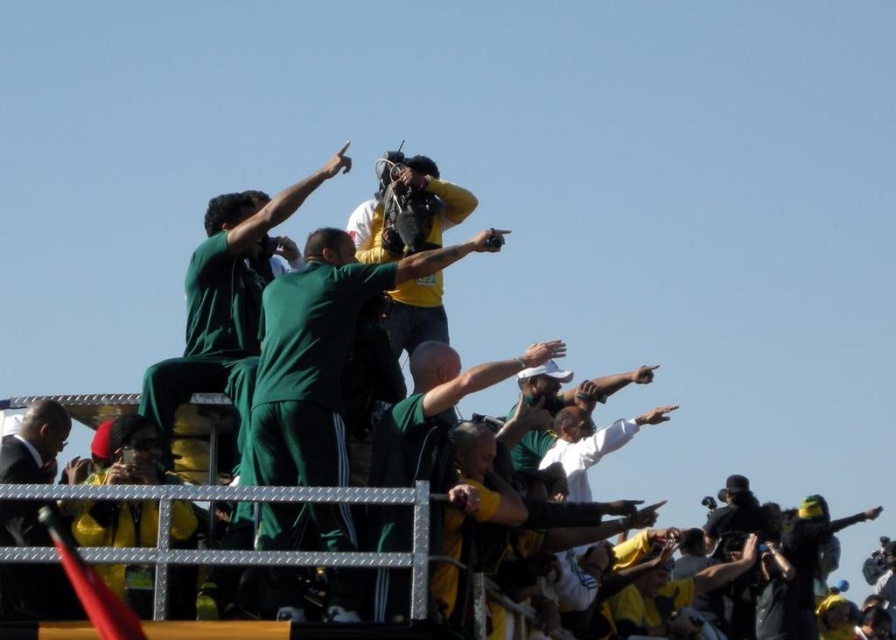
Is point (455, 358) more distant than point (2, 576)?

Yes, point (455, 358) is behind point (2, 576).

Is green jersey at center positioned at the back of black suit at lower left?

No, green jersey at center is closer to the viewer.

Does point (428, 388) come farther from viewer compared to point (54, 470)?

Yes, it is.

Locate an element on the screen. green jersey at center is located at coordinates (437, 419).

Who is more forward, (251, 438) or (445, 451)?

Point (445, 451)

Can you confirm if green matte uniform at center is positioned to the left of green jersey at center?

Correct, you'll find green matte uniform at center to the left of green jersey at center.

What do you see at coordinates (320, 355) in the screenshot?
I see `green matte uniform at center` at bounding box center [320, 355].

Identify the location of green matte uniform at center. Image resolution: width=896 pixels, height=640 pixels. (320, 355).

Can you confirm if green matte uniform at center is thinner than black suit at lower left?

No.

Can you confirm if green matte uniform at center is taller than black suit at lower left?

Yes.

Describe the element at coordinates (320, 355) in the screenshot. I see `green matte uniform at center` at that location.

You are a GUI agent. You are given a task and a screenshot of the screen. Output one action in this format:
    pyautogui.click(x=<x>, y=<y>)
    Task: Click on the green matte uniform at center
    
    Given the screenshot: What is the action you would take?
    pyautogui.click(x=320, y=355)